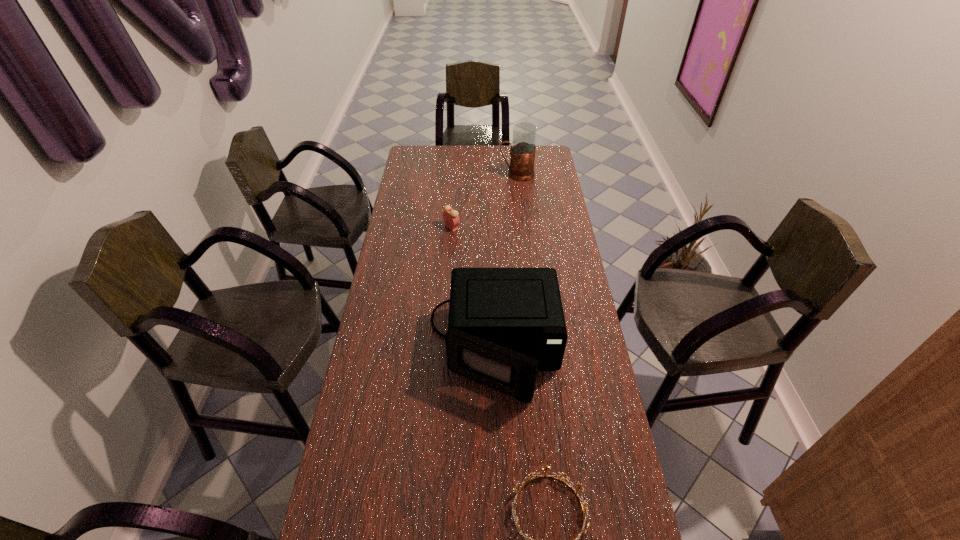
At what (x,y) coordinates should I click in order to perform the action: click on free space between the farthest object and the third tallest object. Please return your answer as a coordinate pair (x, y). Looking at the image, I should click on (485, 201).

At what (x,y) coordinates should I click in order to perform the action: click on free spot between the second farthest object and the tallest object. Please return your answer as a coordinate pair (x, y). This screenshot has width=960, height=540. Looking at the image, I should click on (485, 201).

The image size is (960, 540). In order to click on object that stands as the third closest to the second shortest object in this screenshot , I will do `click(530, 476)`.

Image resolution: width=960 pixels, height=540 pixels. Find the location of `object that is the third closest to the alarm clock`. object that is the third closest to the alarm clock is located at coordinates (530, 476).

What are the coordinates of `vacant space that satisfies the following two spatial constraints: 1. with the handle on the side of the farthest object; 2. with the door open on the second tallest object` in the screenshot? It's located at (536, 349).